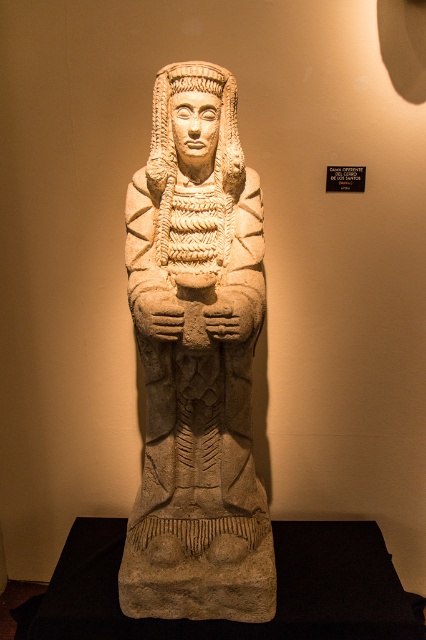
You are standing in front of the statue and want to take a photo. There are two points marked on the floor in front of the pedestal. One is at coordinates point (164,531) and the other at point (157,148). Which point is closer to the statue?

Point (157,148) is closer to the statue because it is in front of point (164,531), which is behind it.

You are a museum curator arranging an exhibition. You need to place a label next to the beige stone statue at center and beige stone headdress at center. Where should you place the label so that it is visible from the front of both objects?

The label should be placed below the beige stone headdress at center since the beige stone statue at center is positioned under it, ensuring visibility from the front of both objects.

You are an art conservator tasked with moving the beige stone statue at center and the beige stone headdress at center to a new exhibition space. The doorway you must use has a maximum width capacity of 1.2 meters. If the headdress is 0.8 meters wide, can both items fit through the doorway individually without being damaged?

The beige stone headdress at center is 0.8 meters wide, which is under the doorway width of 1.2 meters, so it can pass through safely. However, the beige stone statue at center is wider than the headdress, so it exceeds the doorway width limit and cannot be moved through the doorway without risking damage.